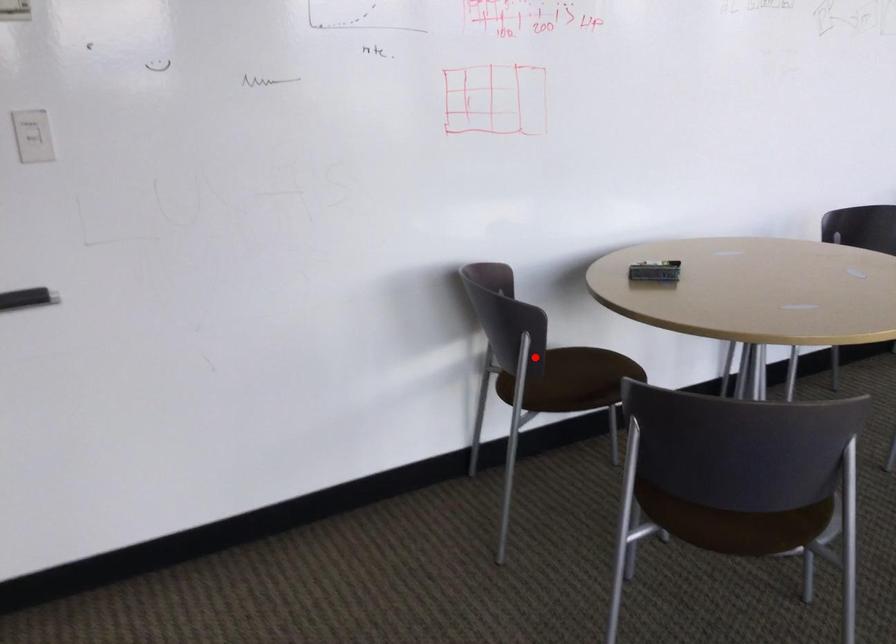
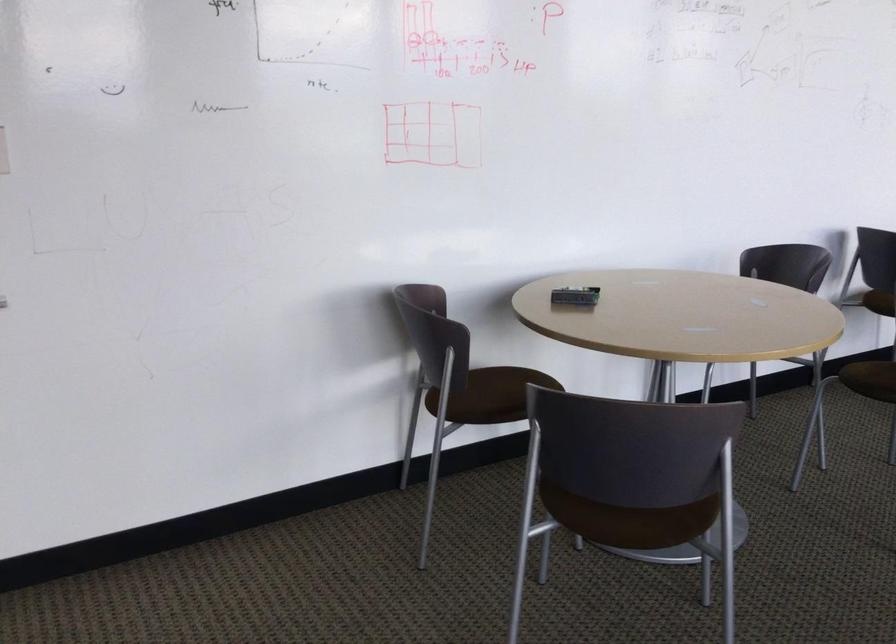
Find the pixel in the second image that matches the highlighted location in the first image.

(458, 371)